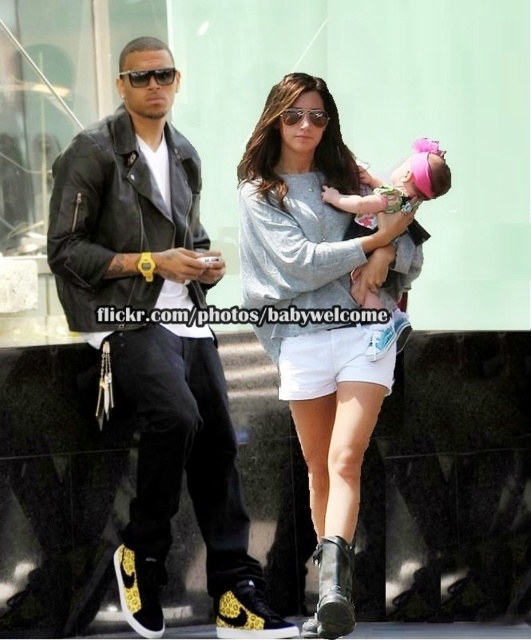
You are a photographer trying to capture a candid shot of the leather jacket at left and the gray cotton sweater at center. Since you want to focus on both subjects equally, which one should you adjust your camera angle to prioritize based on their positions?

The leather jacket at left is located above the gray cotton sweater at center, so to focus on both equally, you should adjust your camera angle to look slightly upward to include the leather jacket at left and downward to capture the gray cotton sweater at center in the same frame.

You are a photographer trying to capture a photo of the leather jacket at left without including the modern glass building in the background. Based on its position, can you determine if adjusting your camera angle downward would help achieve this?

The leather jacket at left is located at point (131, 202), which is lower in the frame. Adjusting the camera angle downward might move the focus further down, potentially excluding the modern glass building in the background. However, without knowing the building position, it is uncertain. But since the jacket is already lower, tilting down could help avoid the building above.